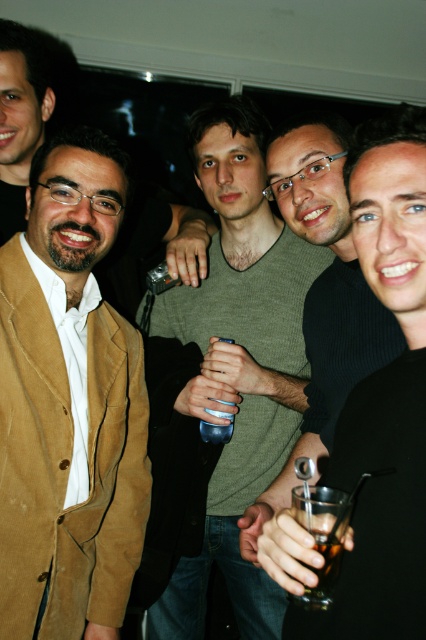
Question: Where is brown leather jacket at center located in relation to translucent glass drink at center in the image?

Choices:
 (A) right
 (B) left

Answer: (B)

Question: Which point is closer to the camera taking this photo?

Choices:
 (A) (328, 600)
 (B) (3, 54)
 (C) (23, 237)
 (D) (229, 433)

Answer: (A)

Question: Can you confirm if suede tan jacket at left is smaller than black matte glass at center?

Choices:
 (A) yes
 (B) no

Answer: (B)

Question: Among these points, which one is nearest to the camera?

Choices:
 (A) (54, 600)
 (B) (396, 266)
 (C) (3, 152)
 (D) (316, 547)

Answer: (D)

Question: Which object is the farthest from the suede tan jacket at left?

Choices:
 (A) green knitwear at center
 (B) translucent glass drink at center

Answer: (B)

Question: Can you confirm if suede tan jacket at left is positioned above clear plastic cup at center?

Choices:
 (A) yes
 (B) no

Answer: (A)